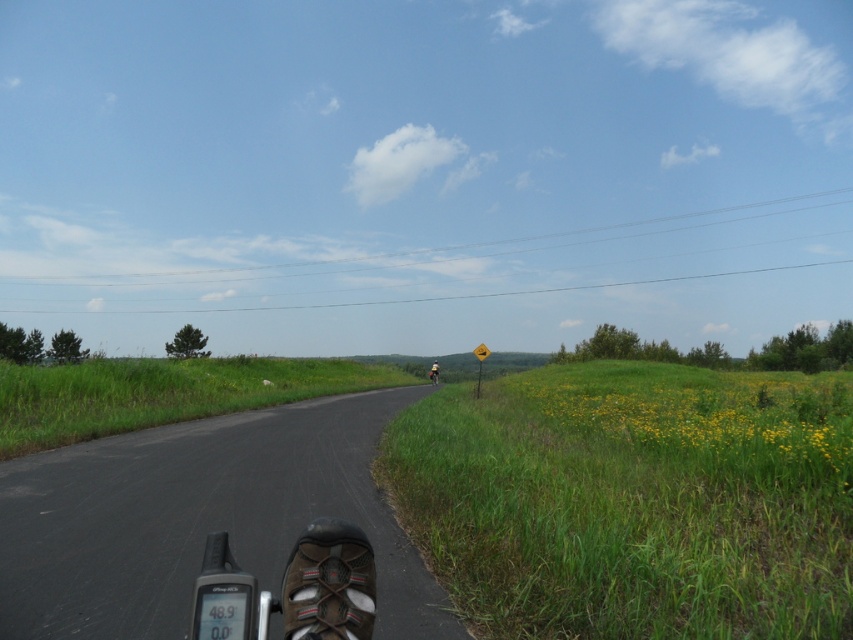
Question: Considering the relative positions of green grassy hillside at right and yellow reflective vest at center in the image provided, where is green grassy hillside at right located with respect to yellow reflective vest at center?

Choices:
 (A) right
 (B) left

Answer: (A)

Question: Which object is farther from the camera taking this photo?

Choices:
 (A) yellow reflective vest at center
 (B) yellow reflective plastic sign at center
 (C) green grassy hillside at right

Answer: (A)

Question: Is green grassy hillside at right to the right of yellow reflective plastic sign at center from the viewer's perspective?

Choices:
 (A) no
 (B) yes

Answer: (B)

Question: Is yellow reflective plastic sign at center below yellow reflective vest at center?

Choices:
 (A) no
 (B) yes

Answer: (A)

Question: Which object is closer to the camera taking this photo?

Choices:
 (A) green grassy hillside at right
 (B) yellow reflective plastic sign at center
 (C) yellow reflective vest at center

Answer: (A)

Question: Which object is farther from the camera taking this photo?

Choices:
 (A) yellow reflective vest at center
 (B) green grassy hillside at right
 (C) yellow reflective plastic sign at center

Answer: (A)